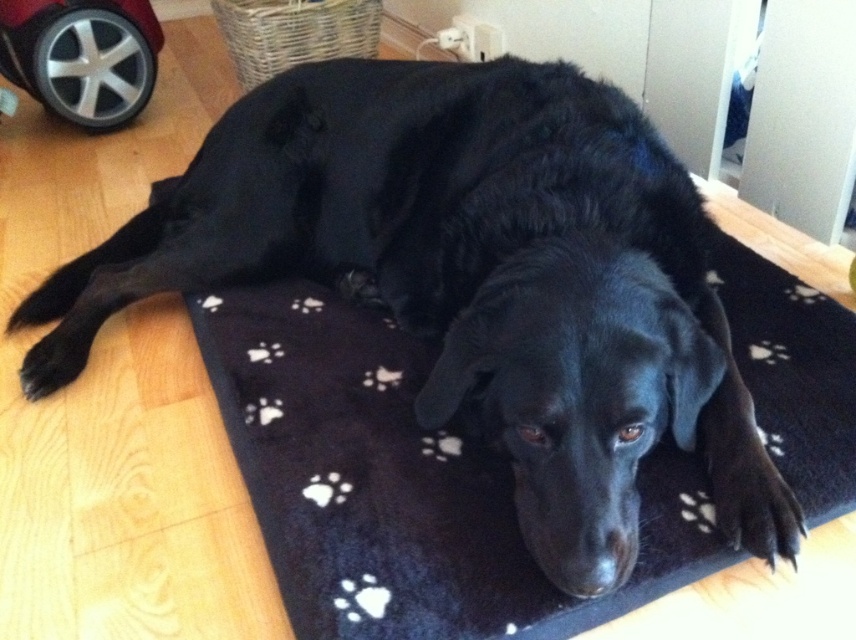
You are a dog owner who wants to place your dog on the black fleece dog bed at center. However, you notice the black fuzzy paw at lower right. Will the dog bed be higher than the paw?

The black fleece dog bed at center has a greater height compared to the black fuzzy paw at lower right, so yes, the dog bed will be higher than the paw.

You are trying to place a small toy on the floor near the black fleece dog bed at center. Based on the coordinates provided, where should you place the toy relative to the dog bed?

The black fleece dog bed at center is located at point (403, 483), so you should place the toy near those coordinates on the floor.

You are standing at the position of the black dog and want to move towards the wall behind you. Which point, point (x=470, y=620) or point (x=62, y=358), is closer to your current position?

Point (x=62, y=358) is closer to your current position because it is behind the dog, while point (x=470, y=620) is in front of it.